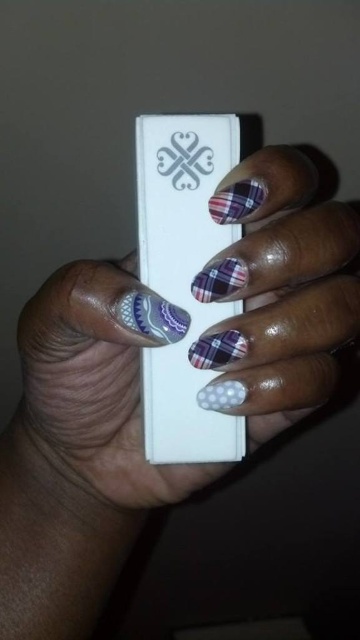
Is white matte wii remote at center further to camera compared to matte silver heart at center?

No, it is not.

From the picture: Can you confirm if white matte wii remote at center is positioned to the left of matte silver heart at center?

Incorrect, white matte wii remote at center is not on the left side of matte silver heart at center.

Identify the location of white matte wii remote at center. The image size is (360, 640). (183, 276).

Locate an element on the screen. The height and width of the screenshot is (640, 360). polka dot nail polish at center is located at coordinates (288, 294).

Measure the distance between polka dot nail polish at center and camera.

20.98 inches

Find the location of a particular element. Image resolution: width=360 pixels, height=640 pixels. polka dot nail polish at center is located at coordinates (288, 294).

Who is more distant from viewer, (86, 298) or (236, 138)?

The point (236, 138) is more distant.

At what (x,y) coordinates should I click in order to perform the action: click on polka dot nail polish at center. Please return your answer as a coordinate pair (x, y). Looking at the image, I should click on (288, 294).